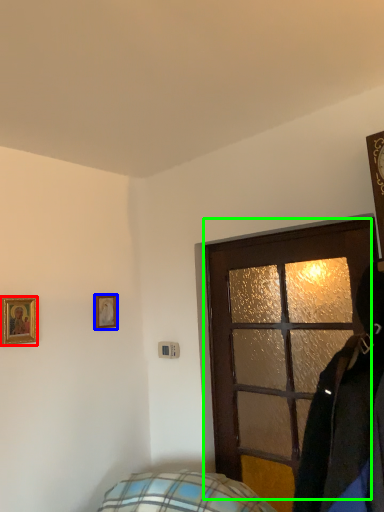
Question: Considering the real-world distances, which object is closest to picture frame (highlighted by a red box)? picture frame (highlighted by a blue box) or door (highlighted by a green box).

Choices:
 (A) picture frame
 (B) door

Answer: (A)